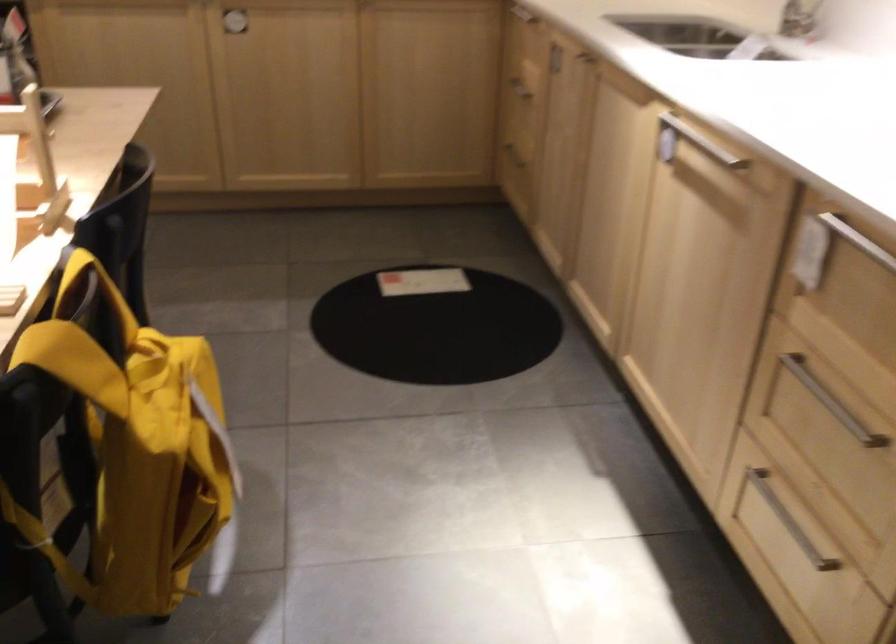
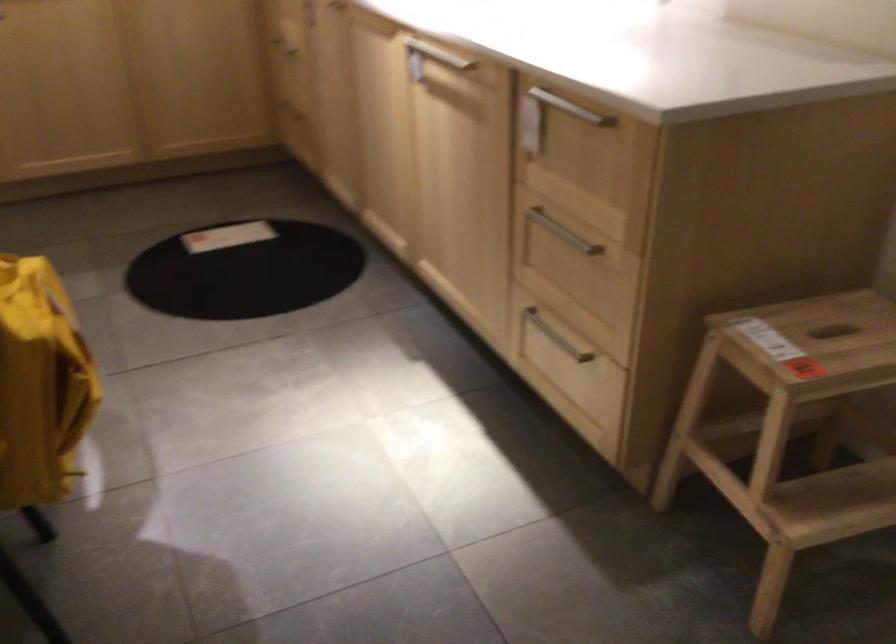
Find the pixel in the second image that matches (677,133) in the first image.

(428, 59)